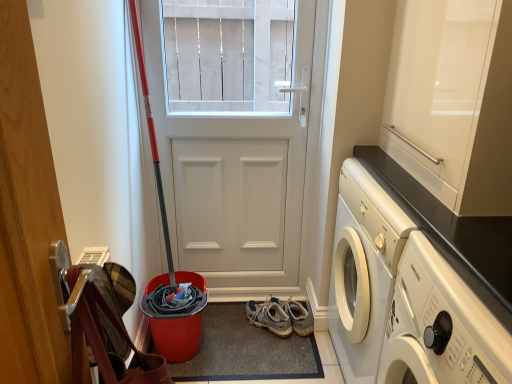
Question: Is white matte door at center to the left of gray suede sneakers at lower center from the viewer's perspective?

Choices:
 (A) yes
 (B) no

Answer: (A)

Question: Does white matte door at center come behind gray suede sneakers at lower center?

Choices:
 (A) yes
 (B) no

Answer: (B)

Question: From a real-world perspective, is white matte door at center beneath gray suede sneakers at lower center?

Choices:
 (A) no
 (B) yes

Answer: (A)

Question: Can you confirm if white matte door at center is taller than gray suede sneakers at lower center?

Choices:
 (A) yes
 (B) no

Answer: (A)

Question: Are white matte door at center and gray suede sneakers at lower center making contact?

Choices:
 (A) no
 (B) yes

Answer: (A)

Question: Would you say gray suede sneakers at lower center is part of white matte door at center's contents?

Choices:
 (A) no
 (B) yes

Answer: (A)

Question: Is glossy white cabinet at upper right not close to white matte door at center?

Choices:
 (A) yes
 (B) no

Answer: (B)

Question: Is the depth of glossy white cabinet at upper right less than that of white matte door at center?

Choices:
 (A) yes
 (B) no

Answer: (A)

Question: Is glossy white cabinet at upper right at the right side of white matte door at center?

Choices:
 (A) yes
 (B) no

Answer: (A)

Question: Does glossy white cabinet at upper right have a lesser width compared to white matte door at center?

Choices:
 (A) no
 (B) yes

Answer: (A)

Question: Considering the relative sizes of glossy white cabinet at upper right and white matte door at center in the image provided, is glossy white cabinet at upper right smaller than white matte door at center?

Choices:
 (A) no
 (B) yes

Answer: (A)

Question: Could you tell me if glossy white cabinet at upper right is turned towards white matte door at center?

Choices:
 (A) yes
 (B) no

Answer: (B)

Question: Is glossy white cabinet at upper right shorter than gray suede sneakers at lower center?

Choices:
 (A) yes
 (B) no

Answer: (B)